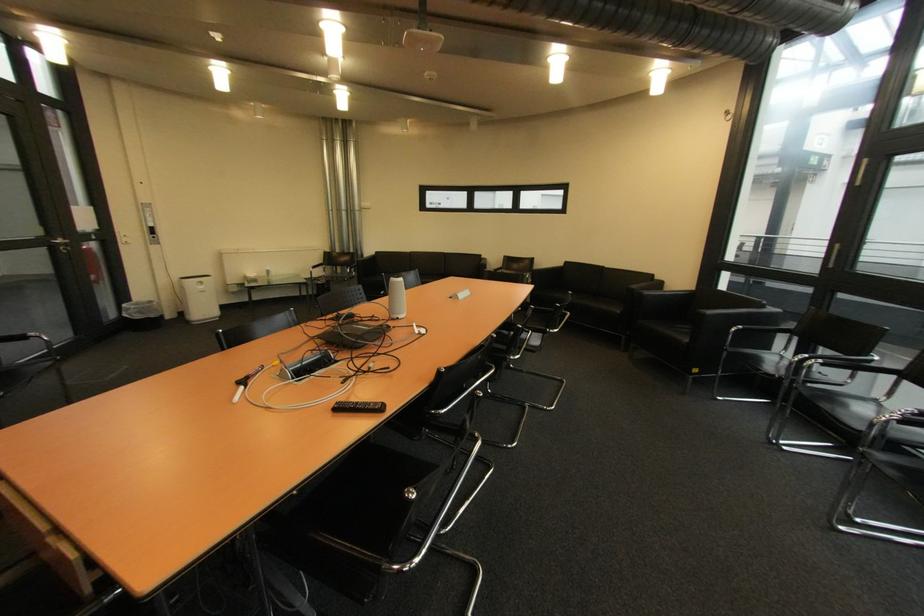
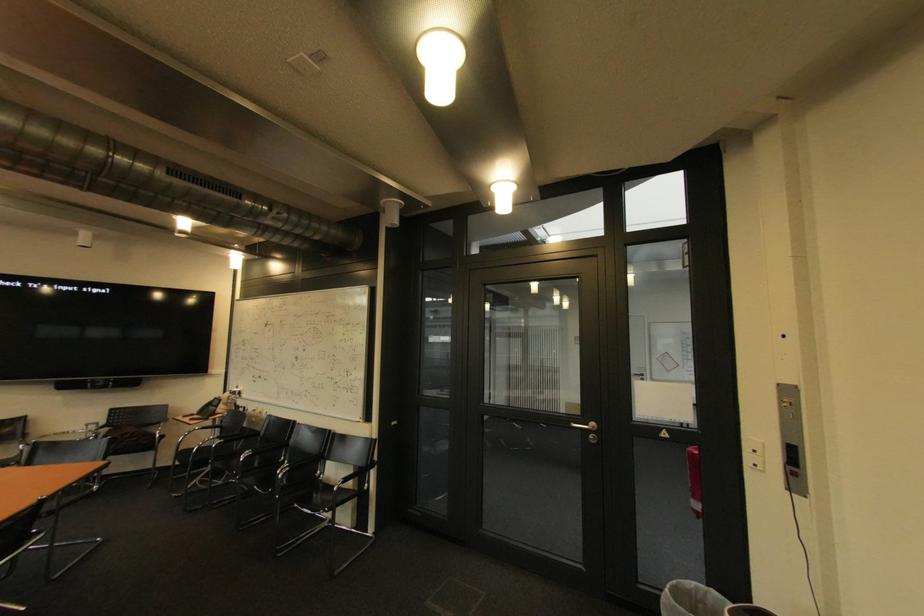
The point at (129, 241) is marked in the first image. Where is the corresponding point in the second image?

(757, 459)